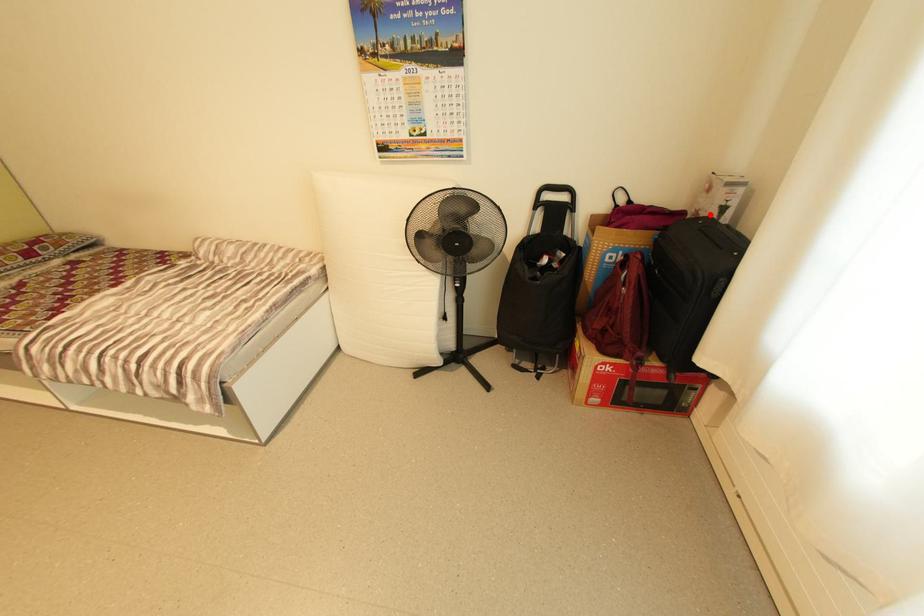
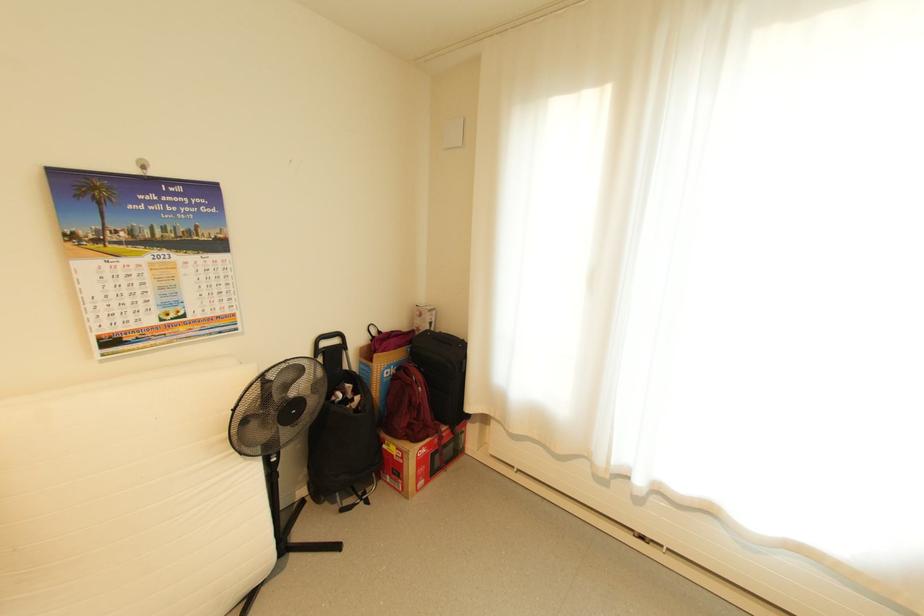
Locate, in the second image, the point that corresponds to the highlighted location in the first image.

(429, 330)